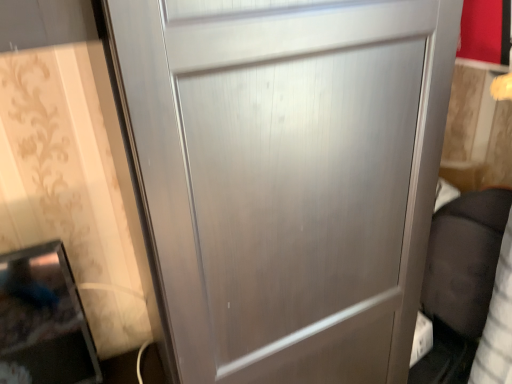
You are a GUI agent. You are given a task and a screenshot of the screen. Output one action in this format:
    pyautogui.click(x=<x>, y=<y>)
    Task: Click on the matte black monitor at lower left
    
    Given the screenshot: What is the action you would take?
    pyautogui.click(x=44, y=318)

The height and width of the screenshot is (384, 512). What do you see at coordinates (44, 318) in the screenshot? I see `matte black monitor at lower left` at bounding box center [44, 318].

This screenshot has width=512, height=384. What are the coordinates of `matte black monitor at lower left` in the screenshot? It's located at click(44, 318).